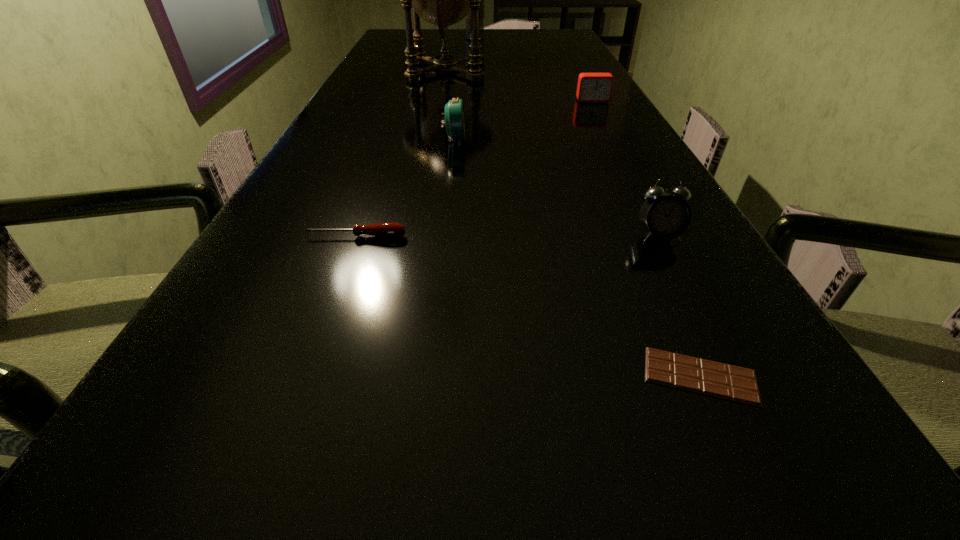
Where is `free space that is in between the shortest alarm clock and the fourth nearest object`? Image resolution: width=960 pixels, height=540 pixels. free space that is in between the shortest alarm clock and the fourth nearest object is located at coordinates (523, 120).

Find the location of a particular element. The width and height of the screenshot is (960, 540). free space between the third farthest object and the leftmost alarm clock is located at coordinates (523, 120).

Where is `empty space between the third shortest object and the leftmost alarm clock`? empty space between the third shortest object and the leftmost alarm clock is located at coordinates (523, 120).

I want to click on empty location between the shortest object and the fourth farthest object, so click(577, 258).

This screenshot has width=960, height=540. What are the coordinates of `free area in between the third farthest object and the farthest object` in the screenshot? It's located at (534, 70).

Find the location of a particular element. Image resolution: width=960 pixels, height=540 pixels. vacant space in between the nearest object and the globe is located at coordinates (573, 223).

Where is `vacant space that's between the wine bottle and the sixth tallest object`? This screenshot has width=960, height=540. vacant space that's between the wine bottle and the sixth tallest object is located at coordinates (416, 138).

In order to click on object that ranks as the second closest to the tallest object in this screenshot , I will do `click(592, 87)`.

What are the coordinates of `object identified as the sixth closest to the leftmost alarm clock` in the screenshot? It's located at (481, 11).

Identify which alarm clock is the nearest to the globe. Please provide its 2D coordinates. Your answer should be formatted as a tuple, i.e. [(x, y)], where the tuple contains the x and y coordinates of a point satisfying the conditions above.

[(592, 87)]